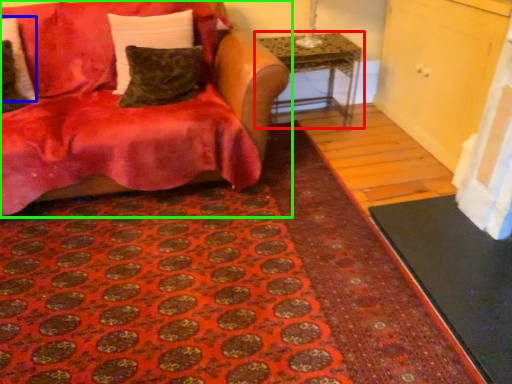
Question: Which is farther away from table (highlighted by a red box)? pillow (highlighted by a blue box) or studio couch (highlighted by a green box)?

Choices:
 (A) pillow
 (B) studio couch

Answer: (A)